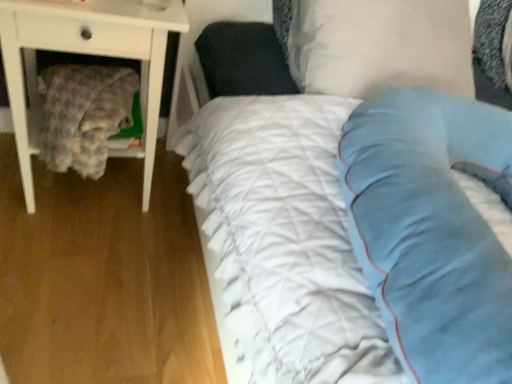
Question: Can you confirm if white wood nightstand at left is wider than fluffy fabric blanket at left?

Choices:
 (A) no
 (B) yes

Answer: (B)

Question: Is white wood nightstand at left not inside fluffy fabric blanket at left?

Choices:
 (A) no
 (B) yes

Answer: (B)

Question: Is white wood nightstand at left to the right of fluffy fabric blanket at left from the viewer's perspective?

Choices:
 (A) no
 (B) yes

Answer: (A)

Question: From a real-world perspective, is white wood nightstand at left located higher than fluffy fabric blanket at left?

Choices:
 (A) yes
 (B) no

Answer: (B)

Question: From the image's perspective, is white wood nightstand at left on top of fluffy fabric blanket at left?

Choices:
 (A) no
 (B) yes

Answer: (B)

Question: In the image, is white soft pillow at upper center positioned in front of or behind fluffy fabric blanket at left?

Choices:
 (A) behind
 (B) front

Answer: (B)

Question: In terms of width, does white soft pillow at upper center look wider or thinner when compared to fluffy fabric blanket at left?

Choices:
 (A) wide
 (B) thin

Answer: (B)

Question: From the image's perspective, relative to fluffy fabric blanket at left, is white soft pillow at upper center above or below?

Choices:
 (A) below
 (B) above

Answer: (B)

Question: In terms of size, does white soft pillow at upper center appear bigger or smaller than fluffy fabric blanket at left?

Choices:
 (A) small
 (B) big

Answer: (B)

Question: From a real-world perspective, is white soft pillow at upper center positioned above or below white wood nightstand at left?

Choices:
 (A) above
 (B) below

Answer: (A)

Question: From the image's perspective, relative to white wood nightstand at left, is white soft pillow at upper center above or below?

Choices:
 (A) below
 (B) above

Answer: (B)

Question: Considering the positions of white soft pillow at upper center and white wood nightstand at left in the image, is white soft pillow at upper center bigger or smaller than white wood nightstand at left?

Choices:
 (A) big
 (B) small

Answer: (B)

Question: Considering the positions of white soft pillow at upper center and white wood nightstand at left in the image, is white soft pillow at upper center wider or thinner than white wood nightstand at left?

Choices:
 (A) thin
 (B) wide

Answer: (A)

Question: Would you say white wood nightstand at left is to the left or to the right of fluffy fabric blanket at left in the picture?

Choices:
 (A) right
 (B) left

Answer: (B)

Question: Is white wood nightstand at left taller or shorter than fluffy fabric blanket at left?

Choices:
 (A) short
 (B) tall

Answer: (B)